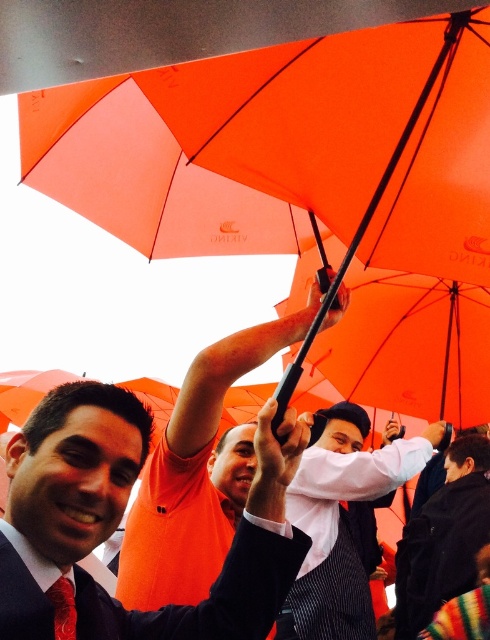
Where is the dark blue wool coat at center located in the image?

The dark blue wool coat at center is located at point 0.842 on the x axis and 0.906 on the y axis.

You are a photographer standing in the scene. You want to take a photo of both the matte orange shirt at upper center and the matte orange shirt at center without any overlap. Given their distance apart, is this possible?

The matte orange shirt at upper center is 25.04 inches away from the matte orange shirt at center. Since this distance allows enough space between them, you can position your camera to capture both shirts without overlap.